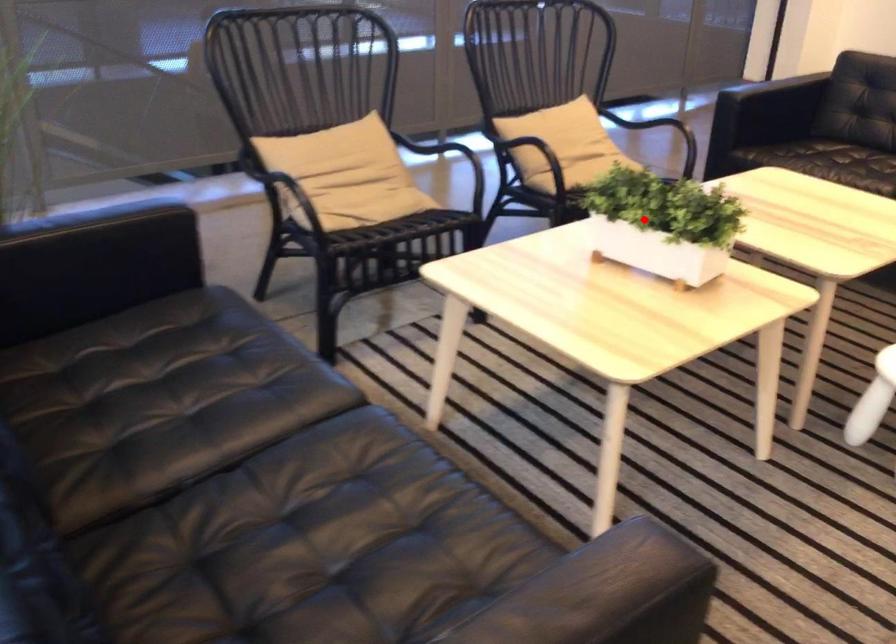
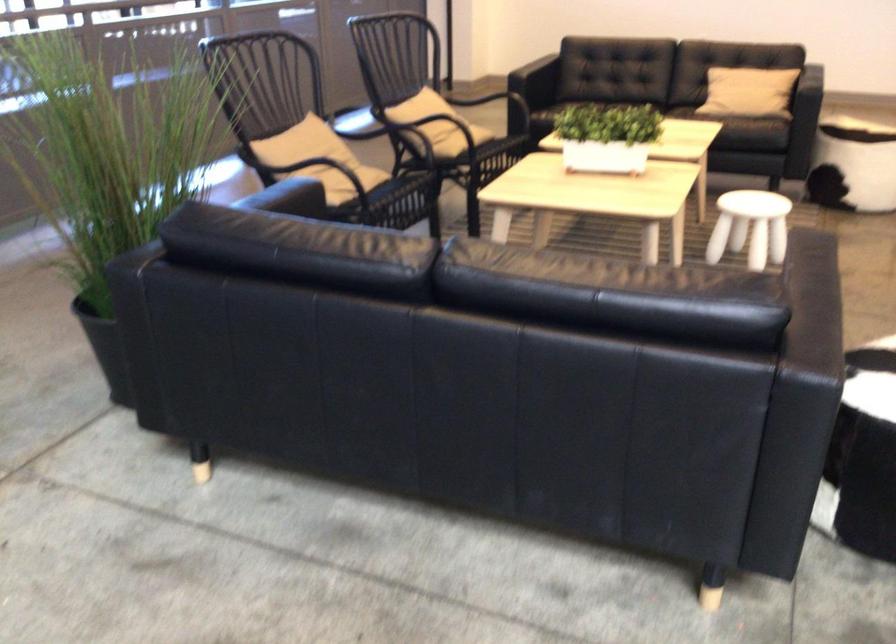
Question: A red point is marked in image1. In image2, is the corresponding 3D point closer to the camera or farther? Reply with the corresponding letter.

Choices:
 (A) The corresponding 3D point is closer.
 (B) The corresponding 3D point is farther.

Answer: (B)